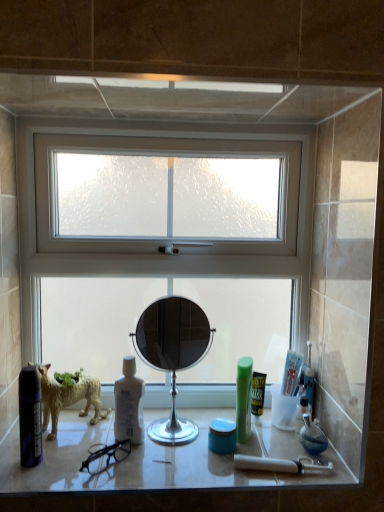
Find the location of a particular element. This screenshot has width=384, height=512. vacant space in front of matte black can at left is located at coordinates (28, 482).